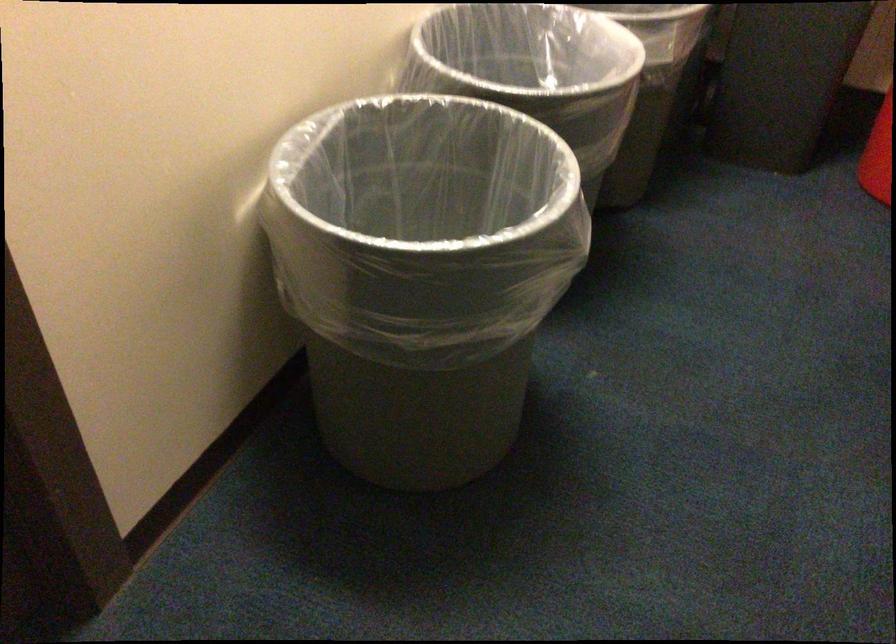
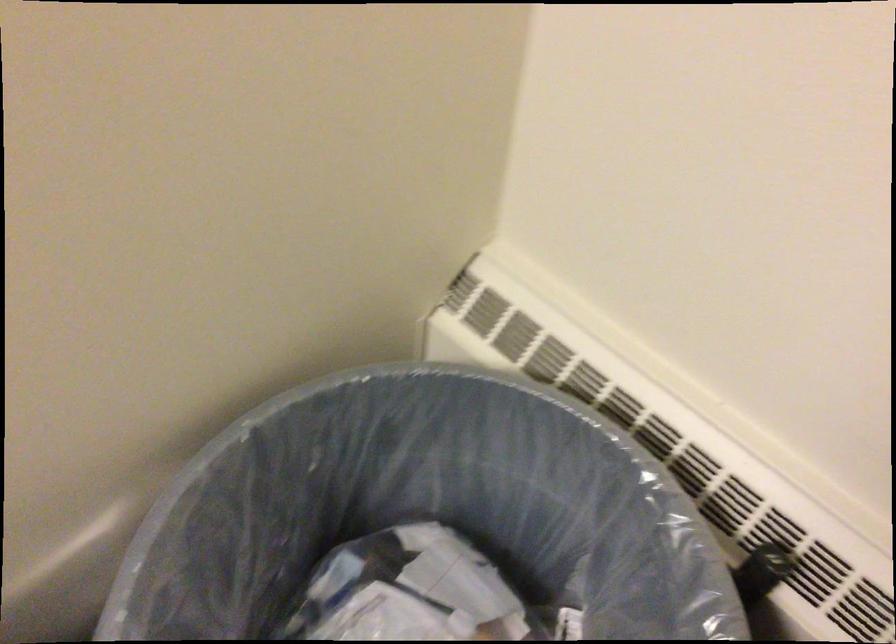
In a continuous first-person perspective shot, in which direction is the camera moving?

The cameraman walked toward right, forward.